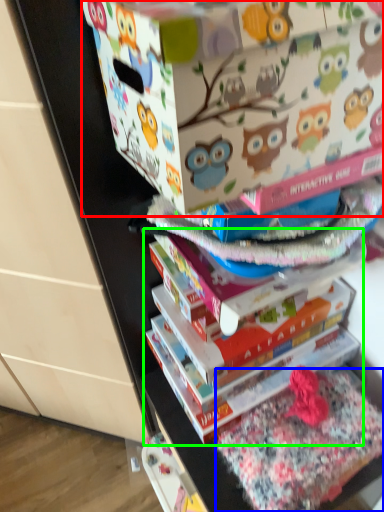
Question: Which object is positioned farthest from cardboard box (highlighted by a red box)? Select from fabric (highlighted by a blue box) and book (highlighted by a green box).

Choices:
 (A) fabric
 (B) book

Answer: (A)